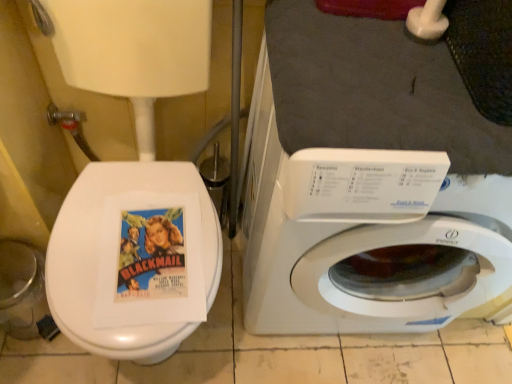
Image resolution: width=512 pixels, height=384 pixels. Describe the element at coordinates (372, 242) in the screenshot. I see `white plastic washing machine at center` at that location.

Locate an element on the screen. The height and width of the screenshot is (384, 512). white plastic washing machine at center is located at coordinates (372, 242).

Identify the location of white plastic washing machine at center. The image size is (512, 384). (372, 242).